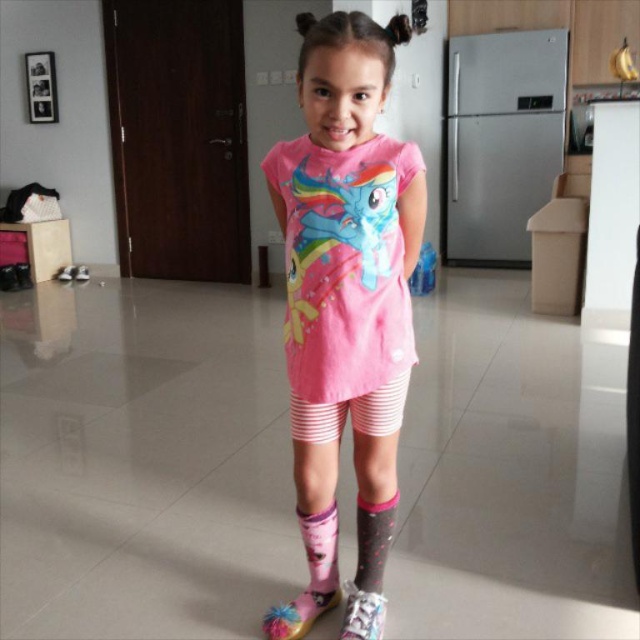
Find the location of a particular element. pink cotton t-shirt at center is located at coordinates (346, 257).

Does pink cotton t-shirt at center have a larger size compared to pink fabric dress at center?

Yes, pink cotton t-shirt at center is bigger than pink fabric dress at center.

Which is in front, point (296, 326) or point (288, 182)?

Point (288, 182) is in front.

The width and height of the screenshot is (640, 640). Identify the location of pink cotton t-shirt at center. (346, 257).

Is pink fabric dress at center bigger than patterned fabric sock at lower center?

Indeed, pink fabric dress at center has a larger size compared to patterned fabric sock at lower center.

Does pink fabric dress at center lie behind patterned fabric sock at lower center?

That is False.

Is point (298, 268) positioned before point (358, 576)?

Yes, it is in front of point (358, 576).

Locate an element on the screen. This screenshot has width=640, height=640. pink fabric dress at center is located at coordinates (342, 264).

Who is taller, pink fabric dress at center or pink fabric boot at lower center?

pink fabric dress at center is taller.

Does pink fabric dress at center appear over pink fabric boot at lower center?

Correct, pink fabric dress at center is located above pink fabric boot at lower center.

This screenshot has width=640, height=640. Describe the element at coordinates (342, 264) in the screenshot. I see `pink fabric dress at center` at that location.

The width and height of the screenshot is (640, 640). I want to click on pink fabric dress at center, so click(x=342, y=264).